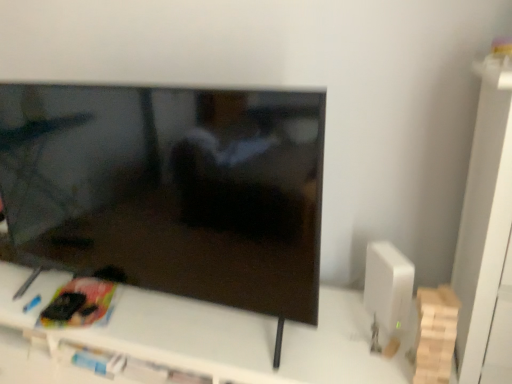
Question: Does white plastic tv stand at center touch matte black tv at center?

Choices:
 (A) yes
 (B) no

Answer: (B)

Question: Is the position of white plastic tv stand at center less distant than that of matte black tv at center?

Choices:
 (A) yes
 (B) no

Answer: (B)

Question: Is white plastic tv stand at center thinner than matte black tv at center?

Choices:
 (A) yes
 (B) no

Answer: (B)

Question: Considering the relative sizes of white plastic tv stand at center and matte black tv at center in the image provided, is white plastic tv stand at center shorter than matte black tv at center?

Choices:
 (A) yes
 (B) no

Answer: (A)

Question: Would you consider white plastic tv stand at center to be distant from matte black tv at center?

Choices:
 (A) no
 (B) yes

Answer: (A)

Question: Considering their positions, is matte black tv at center located in front of or behind white plastic tv stand at center?

Choices:
 (A) behind
 (B) front

Answer: (B)

Question: In the image, is matte black tv at center on the left side or the right side of white plastic tv stand at center?

Choices:
 (A) left
 (B) right

Answer: (A)

Question: Is matte black tv at center wider or thinner than white plastic tv stand at center?

Choices:
 (A) wide
 (B) thin

Answer: (B)

Question: Is matte black tv at center inside the boundaries of white plastic tv stand at center, or outside?

Choices:
 (A) inside
 (B) outside

Answer: (B)

Question: Is white matte cabinet at right bigger or smaller than matte black tv at center?

Choices:
 (A) big
 (B) small

Answer: (B)

Question: In the image, is white matte cabinet at right positioned in front of or behind matte black tv at center?

Choices:
 (A) behind
 (B) front

Answer: (B)

Question: Is point (473, 369) positioned closer to the camera than point (74, 218)?

Choices:
 (A) closer
 (B) farther

Answer: (A)

Question: Is white matte cabinet at right inside the boundaries of matte black tv at center, or outside?

Choices:
 (A) outside
 (B) inside

Answer: (A)

Question: From the image's perspective, relative to white plastic tv stand at center, is white matte cabinet at right above or below?

Choices:
 (A) below
 (B) above

Answer: (B)

Question: Considering the relative positions of white matte cabinet at right and white plastic tv stand at center in the image provided, is white matte cabinet at right to the left or to the right of white plastic tv stand at center?

Choices:
 (A) left
 (B) right

Answer: (B)